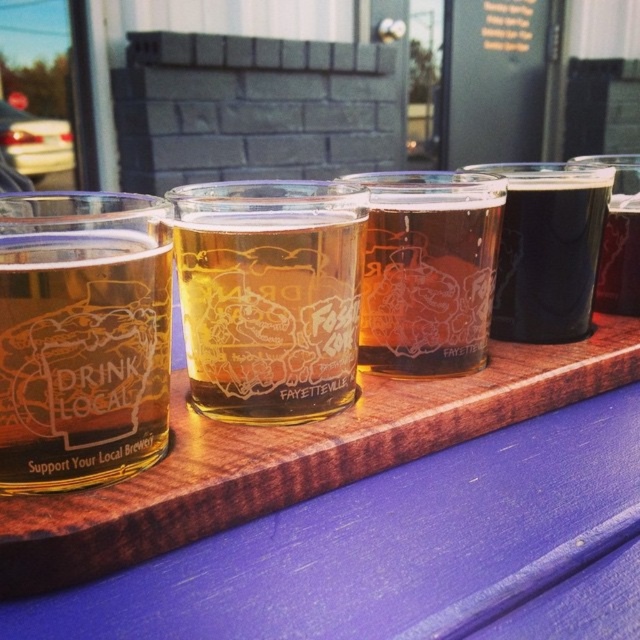
Who is taller, translucent glass at center or translucent glass at upper right?

translucent glass at upper right

Can you confirm if translucent glass at center is smaller than translucent glass at upper right?

Yes.

Is point (472, 198) positioned after point (625, 268)?

No, it is not.

Where is `translucent glass at center`? The height and width of the screenshot is (640, 640). translucent glass at center is located at coordinates (428, 269).

Is point (460, 536) behind point (573, 333)?

No, it is not.

What do you see at coordinates (387, 545) in the screenshot? This screenshot has width=640, height=640. I see `wooden tray at center` at bounding box center [387, 545].

Identify the location of wooden tray at center. (387, 545).

Which of these two, black matte glass at center or translucent glass at upper right, stands shorter?

black matte glass at center

The image size is (640, 640). What are the coordinates of `black matte glass at center` in the screenshot? It's located at (547, 250).